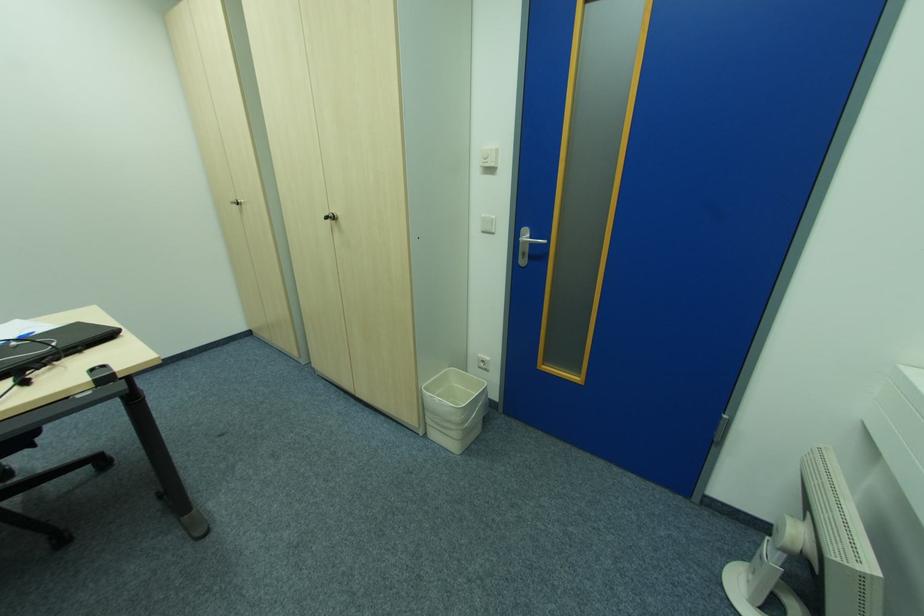
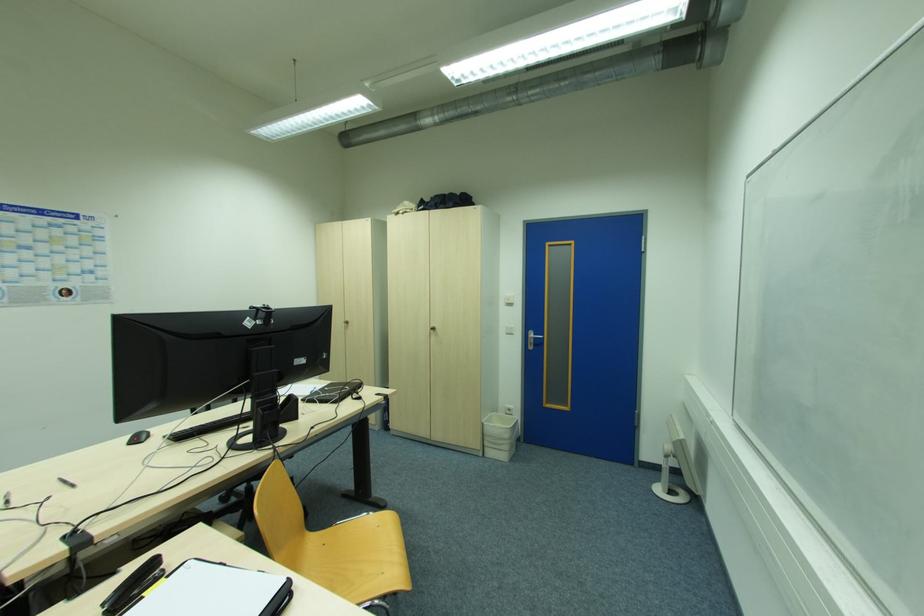
In a continuous first-person perspective shot, in which direction is the camera moving?

The movement direction of the cameraman is left, backward.